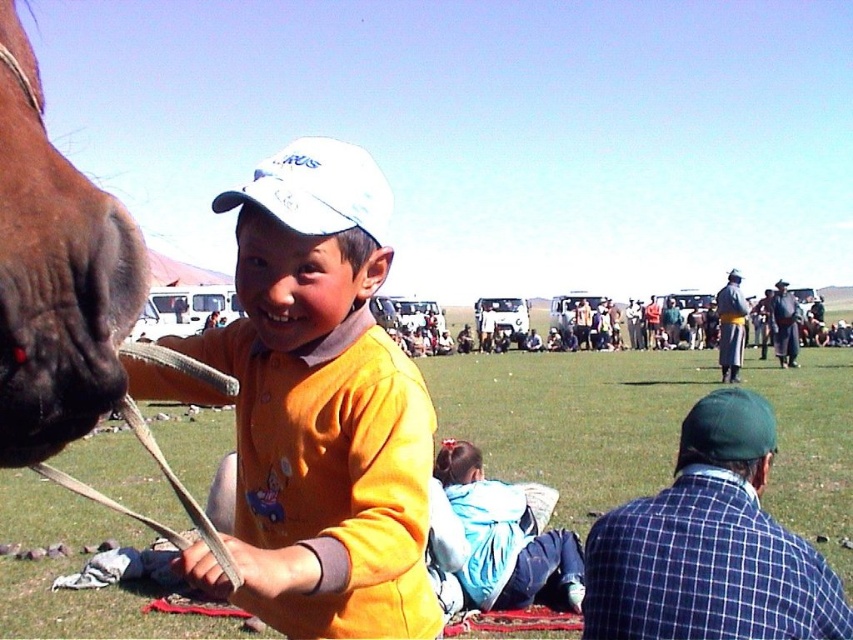
You are a photographer trying to capture a photo of the yellow matte shirt at center and the brown glossy horse at left. If you want to ensure both subjects are in focus, which one should you adjust your camera focus on first?

The yellow matte shirt at center is bigger than the brown glossy horse at left, so you should focus on the yellow matte shirt at center first to ensure proper focus on both subjects.

What is the color of the shirt worn by the person located at the coordinates point (320, 408) in the image?

The yellow matte shirt at center is represented by point (320, 408), so the color is yellow.

You are a photographer trying to capture a photo of the yellow matte shirt at center and the light blue fabric at lower center. To ensure both are in frame, should you adjust your camera to the left or right side of the scene?

The yellow matte shirt at center is positioned on the left side of the light blue fabric at lower center. To include both in the frame, you should adjust your camera to the left side of the scene so that the leftmost object, the yellow matte shirt at center, is within the frame while also capturing the light blue fabric at lower center on the right.